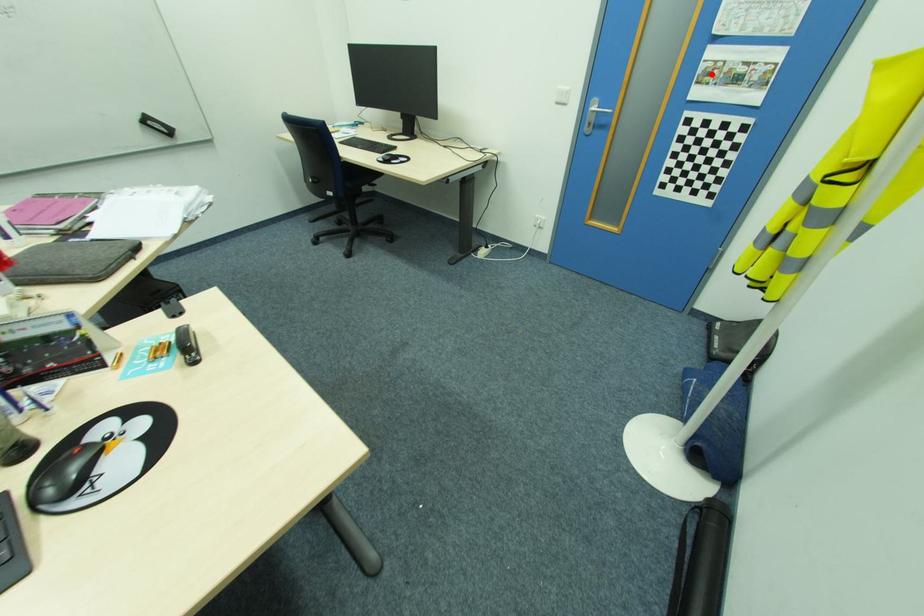
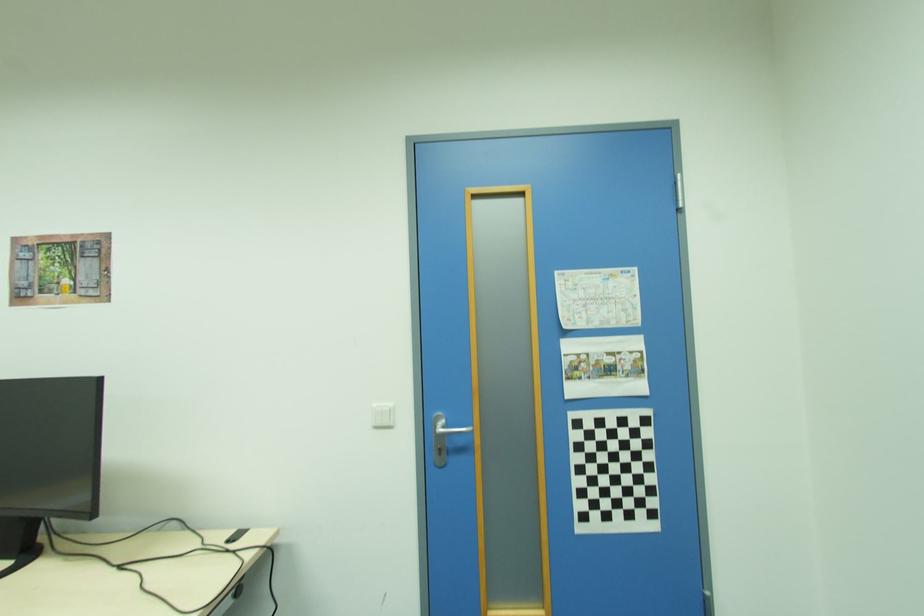
In the second image, find the point that corresponds to the highlighted location in the first image.

(579, 369)